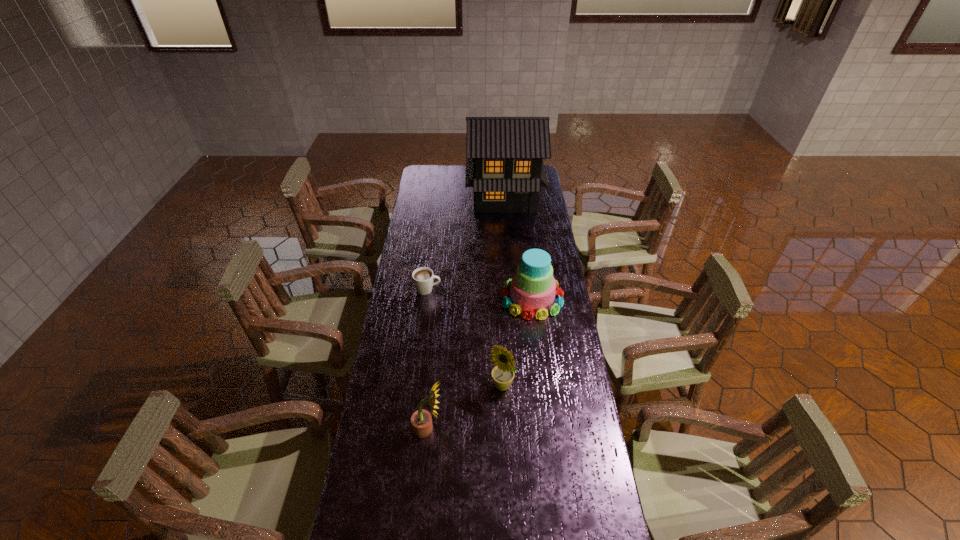
Where is `blank space at the left edge of the desktop`? blank space at the left edge of the desktop is located at coordinates (370, 416).

Locate an element on the screen. The height and width of the screenshot is (540, 960). free space at the right edge is located at coordinates (565, 361).

This screenshot has height=540, width=960. Identify the location of empty space that is in between the nearest object and the cake. (480, 363).

You are a GUI agent. You are given a task and a screenshot of the screen. Output one action in this format:
    pyautogui.click(x=<x>, y=<y>)
    Task: Click on the vacant space in between the tallest object and the shortest object
    
    Given the screenshot: What is the action you would take?
    pyautogui.click(x=466, y=242)

Find the location of a particular element. This screenshot has width=960, height=540. vacant space that's between the dollhouse and the nearest object is located at coordinates (466, 312).

I want to click on free point between the cake and the tallest object, so click(518, 247).

You are a GUI agent. You are given a task and a screenshot of the screen. Output one action in this format:
    pyautogui.click(x=<x>, y=<y>)
    Task: Click on the object that is the fourth closest to the nearer sunflower
    The width and height of the screenshot is (960, 540).
    Given the screenshot: What is the action you would take?
    pos(504,155)

The image size is (960, 540). Identify the location of object that ranks as the fourth closest to the shortest object. (421, 420).